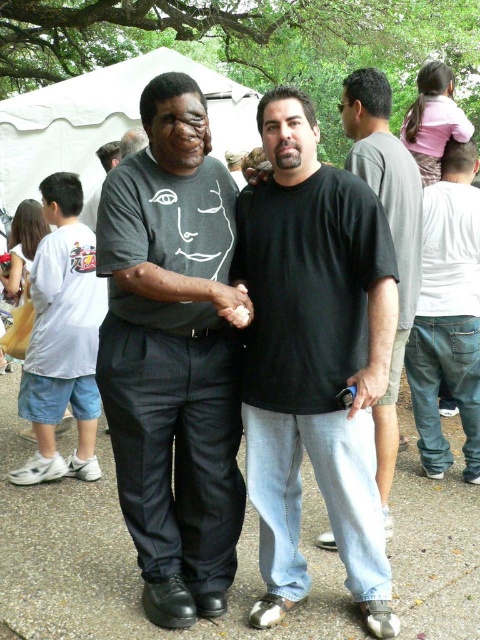
Between matte black shirt at center and white fabric tent at upper center, which one has more height?

With more height is white fabric tent at upper center.

You are a GUI agent. You are given a task and a screenshot of the screen. Output one action in this format:
    pyautogui.click(x=<x>, y=<y>)
    Task: Click on the matte black shirt at center
    This screenshot has height=640, width=480.
    Given the screenshot: What is the action you would take?
    pyautogui.click(x=173, y=355)

Who is more forward, (267, 296) or (400, 296)?

Point (267, 296)

Is point (345, 442) closer to viewer compared to point (351, 97)?

Yes, it is.

Where is `black matte shirt at center`? Image resolution: width=480 pixels, height=640 pixels. black matte shirt at center is located at coordinates (315, 360).

What do you see at coordinates (315, 360) in the screenshot?
I see `black matte shirt at center` at bounding box center [315, 360].

Looking at this image, which of these two, black matte shirt at center or white fabric tent at upper center, stands shorter?

black matte shirt at center is shorter.

Which is behind, point (334, 296) or point (27, 186)?

The point (27, 186) is behind.

Identify the location of black matte shirt at center. (315, 360).